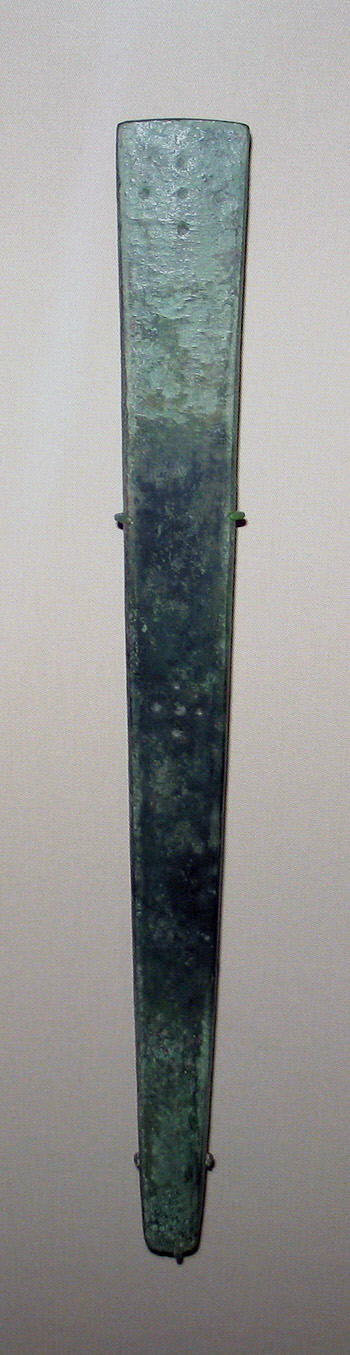
Image resolution: width=350 pixels, height=1355 pixels. I want to click on green tone oblong club shaped art piece, so click(x=184, y=341).